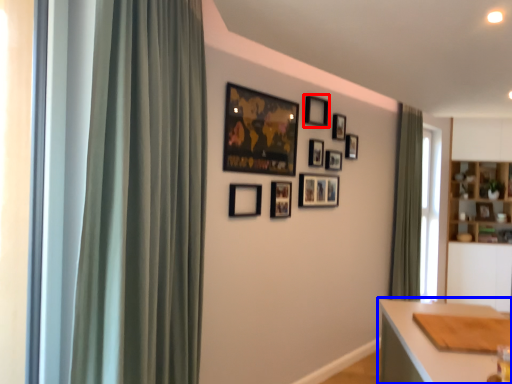
Question: Among these objects, which one is farthest to the camera, picture frame (highlighted by a red box) or table (highlighted by a blue box)?

Choices:
 (A) picture frame
 (B) table

Answer: (A)